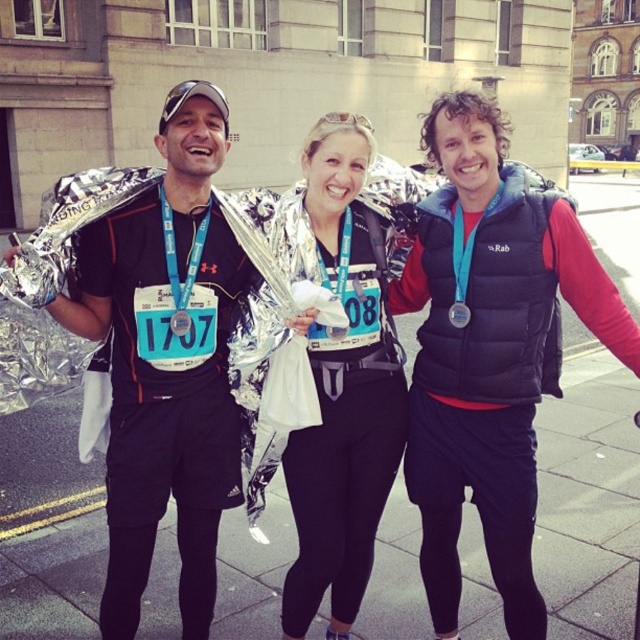
You are a photographer standing 2 meters away from the group. You want to take a photo that captures both the matte black jacket at center and the matte silver foil at center in the same frame. Given the distance between them, will the camera you are using with a 50mm lens be able to fit both objects in the frame?

The matte black jacket at center and matte silver foil at center are 1.34 meters apart. With a 50mm lens, the field of view at 2 meters distance can typically accommodate objects spaced 1.34 meters apart, so yes, both objects can be captured in the same frame.

You are a photographer trying to capture a group photo of the three individuals. Since the two people at the center are wearing a black puffer vest at center and a matte black jacket at center, which one should you position closer to the camera to ensure their clothing details are more visible?

The black puffer vest at center might be wider than matte black jacket at center, so positioning the person wearing the black puffer vest at center closer to the camera would make their clothing details more visible due to its width.

You are a photographer who needs to adjust your position to capture both the black puffer vest at center and the camera in the scene. Given that they are 21.80 feet apart, what is the minimum distance you should move to ensure both are in frame?

The minimum distance you should move is 21.80 feet to ensure both the black puffer vest at center and the camera are within the frame.